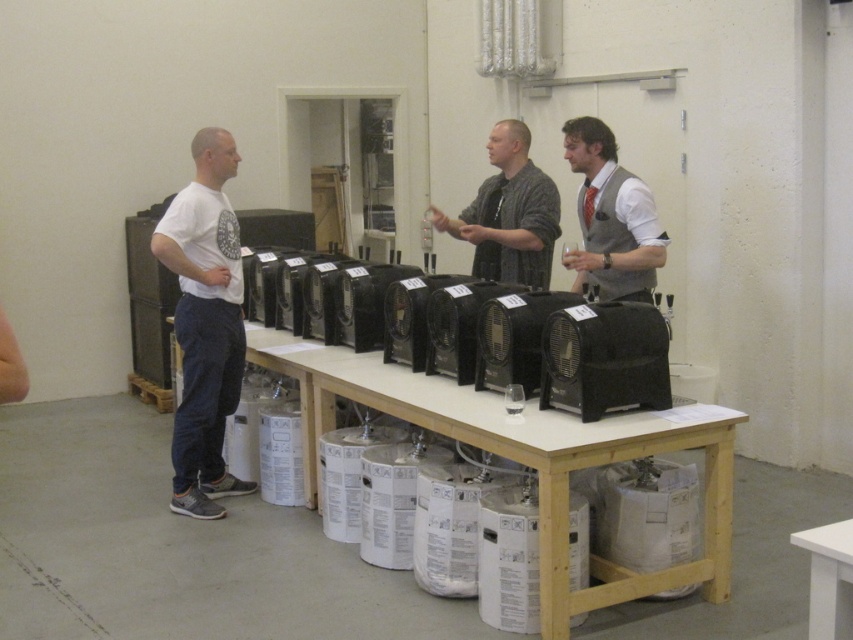
You are an employee in the brewery and need to place a new keg on the wooden table at center. However, you notice someone wearing a matte gray shirt at center is standing there. Can you place the keg on the table without moving the person?

The wooden table at center is below matte gray shirt at center, meaning the person is standing directly on the table. Therefore, you cannot place the keg there without first asking the person to step aside.

You are a brewer who needs to move a 1.2 meter wide crate through the space between the wooden table at center and the matte gray shirt at center. Can you fit it through?

The wooden table at center is wider than the matte gray shirt at center, so the space between them may not be sufficient for a 1.2 meter wide crate. You should check the exact dimensions before attempting to move it.